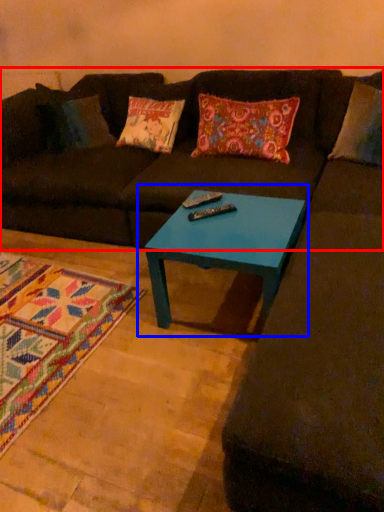
Question: Which object appears closest to the camera in this image, futon (highlighted by a red box) or coffee table (highlighted by a blue box)?

Choices:
 (A) futon
 (B) coffee table

Answer: (B)